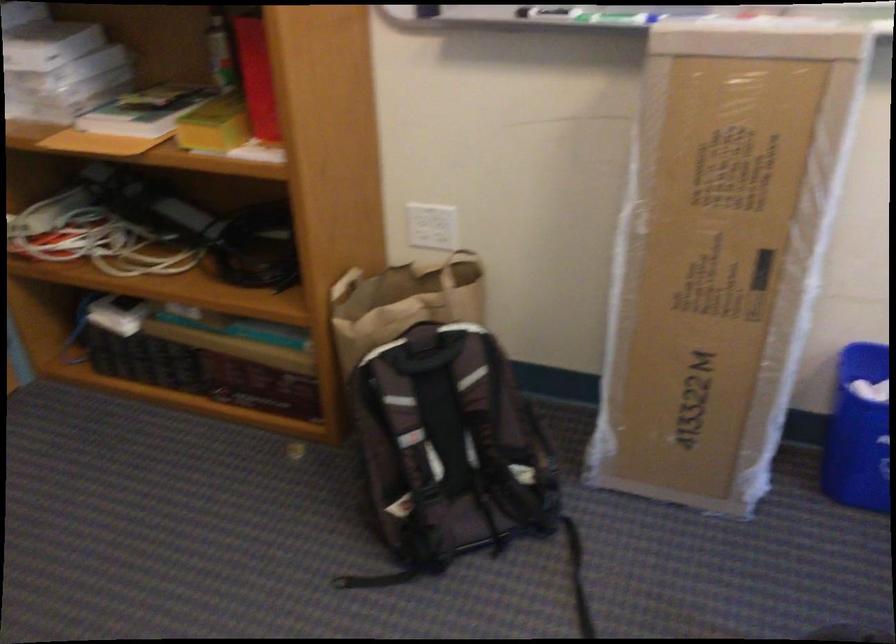
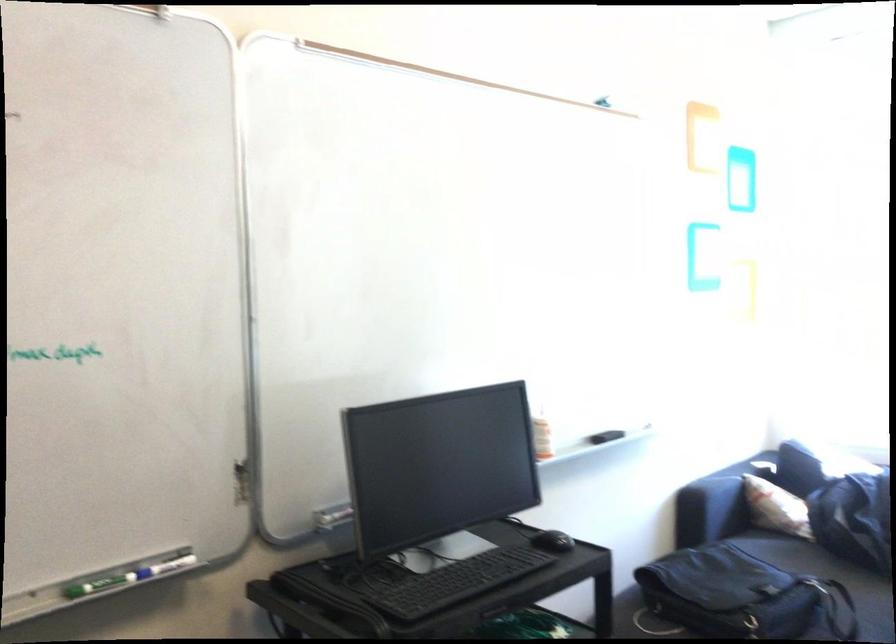
Question: The first image is from the beginning of the video and the second image is from the end. How did the camera likely rotate when shooting the video?

Choices:
 (A) Left
 (B) Right
 (C) Up
 (D) Down

Answer: (B)